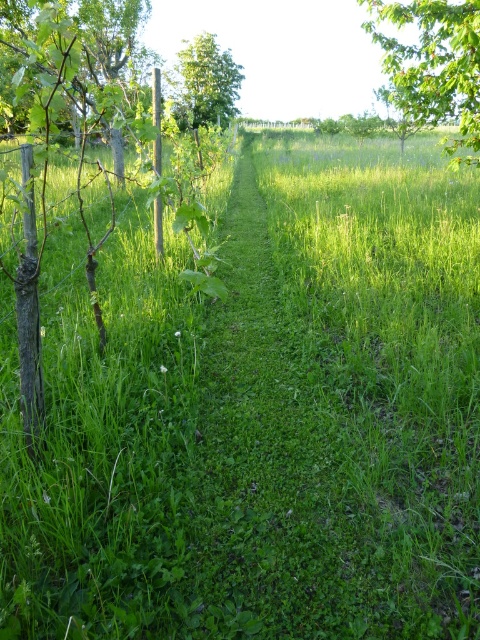
Describe the element at coordinates (433, 65) in the screenshot. I see `green leafy tree at upper right` at that location.

The image size is (480, 640). Describe the element at coordinates (433, 65) in the screenshot. I see `green leafy tree at upper right` at that location.

Locate an element on the screen. The width and height of the screenshot is (480, 640). green leafy tree at upper right is located at coordinates (433, 65).

Who is positioned more to the left, green leafy tree at left or green leafy tree at upper right?

green leafy tree at left is more to the left.

Is green leafy tree at left shorter than green leafy tree at upper right?

In fact, green leafy tree at left may be taller than green leafy tree at upper right.

Does point (151, 188) come closer to viewer compared to point (446, 1)?

Yes, it is in front of point (446, 1).

Where is `green leafy tree at left`? Image resolution: width=480 pixels, height=640 pixels. green leafy tree at left is located at coordinates (100, 250).

Is green leafy tree at left thinner than green leafy tree at center?

No.

Between green leafy tree at left and green leafy tree at center, which one has less height?

green leafy tree at center

Does point (143, 144) come in front of point (202, 83)?

That is True.

Identify the location of green leafy tree at left. The height and width of the screenshot is (640, 480). (100, 250).